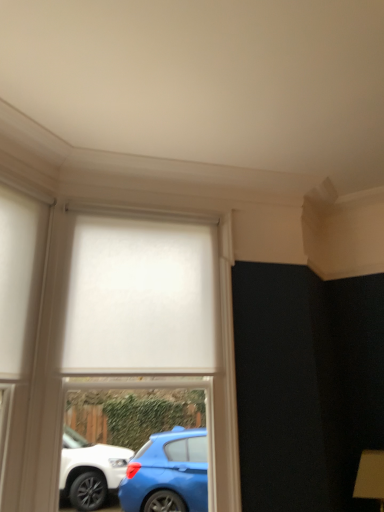
Question: Considering the relative positions of white matte roller blind at center and white matte glass door at left in the image provided, is white matte roller blind at center to the left of white matte glass door at left from the viewer's perspective?

Choices:
 (A) no
 (B) yes

Answer: (A)

Question: From a real-world perspective, is white matte roller blind at center physically below white matte glass door at left?

Choices:
 (A) yes
 (B) no

Answer: (A)

Question: Can you confirm if white matte roller blind at center is taller than white matte glass door at left?

Choices:
 (A) no
 (B) yes

Answer: (B)

Question: From the image's perspective, is white matte roller blind at center under white matte glass door at left?

Choices:
 (A) no
 (B) yes

Answer: (B)

Question: Is the surface of white matte roller blind at center in direct contact with white matte glass door at left?

Choices:
 (A) no
 (B) yes

Answer: (A)

Question: Would you say white matte roller blind at center is a long distance from white matte glass door at left?

Choices:
 (A) yes
 (B) no

Answer: (B)

Question: Is white matte glass door at left facing towards white matte roller blind at center?

Choices:
 (A) no
 (B) yes

Answer: (A)

Question: Can you confirm if white matte glass door at left is shorter than white matte roller blind at center?

Choices:
 (A) yes
 (B) no

Answer: (A)

Question: Is white matte glass door at left completely or partially outside of white matte roller blind at center?

Choices:
 (A) yes
 (B) no

Answer: (A)

Question: Is white matte glass door at left to the left of white matte roller blind at center from the viewer's perspective?

Choices:
 (A) no
 (B) yes

Answer: (B)

Question: Is white matte glass door at left directly adjacent to white matte roller blind at center?

Choices:
 (A) no
 (B) yes

Answer: (A)

Question: From a real-world perspective, is white matte glass door at left positioned over white matte roller blind at center based on gravity?

Choices:
 (A) no
 (B) yes

Answer: (B)

Question: Does white matte curtain at center appear on the left side of white matte roller blind at center?

Choices:
 (A) yes
 (B) no

Answer: (A)